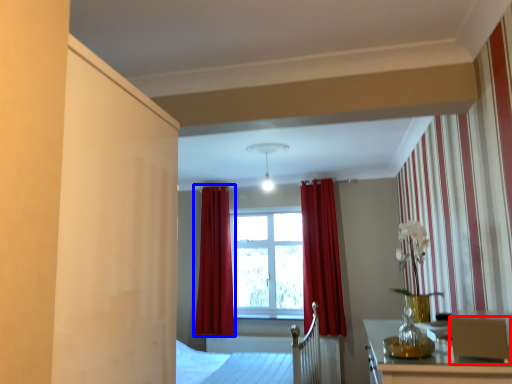
Question: Which object is closer to the camera taking this photo, armchair (highlighted by a red box) or curtain (highlighted by a blue box)?

Choices:
 (A) armchair
 (B) curtain

Answer: (A)